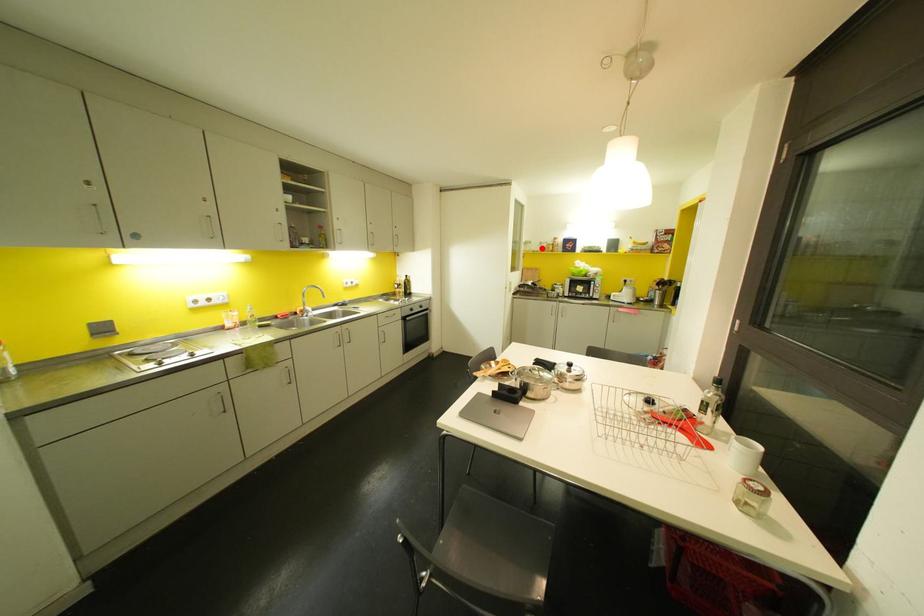
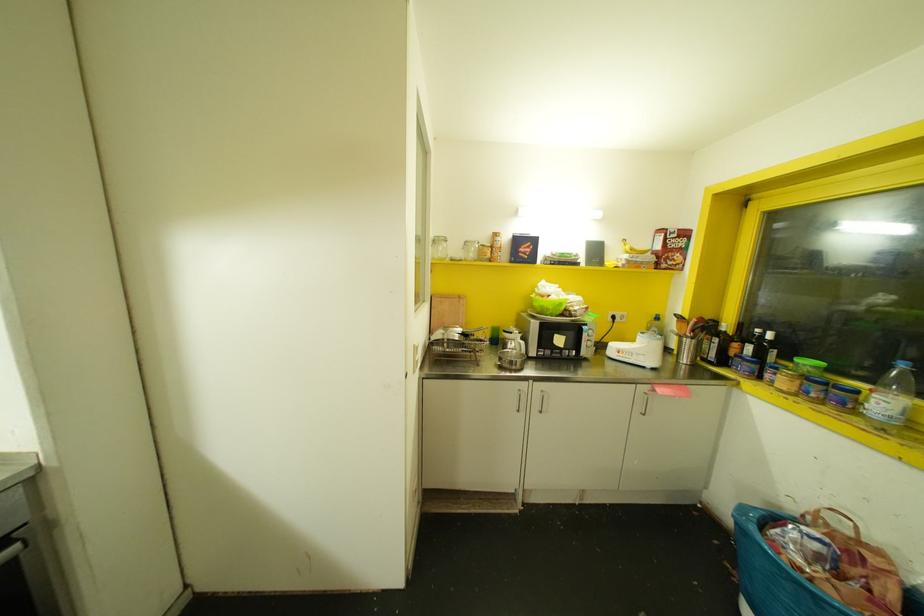
Question: I am providing you with two images of the same scene from different viewpoints. Image1 has a red point marked. In image2, the corresponding 3D location appears at what relative position? Reply with the corresponding letter.

Choices:
 (A) Closer
 (B) Farther

Answer: (B)